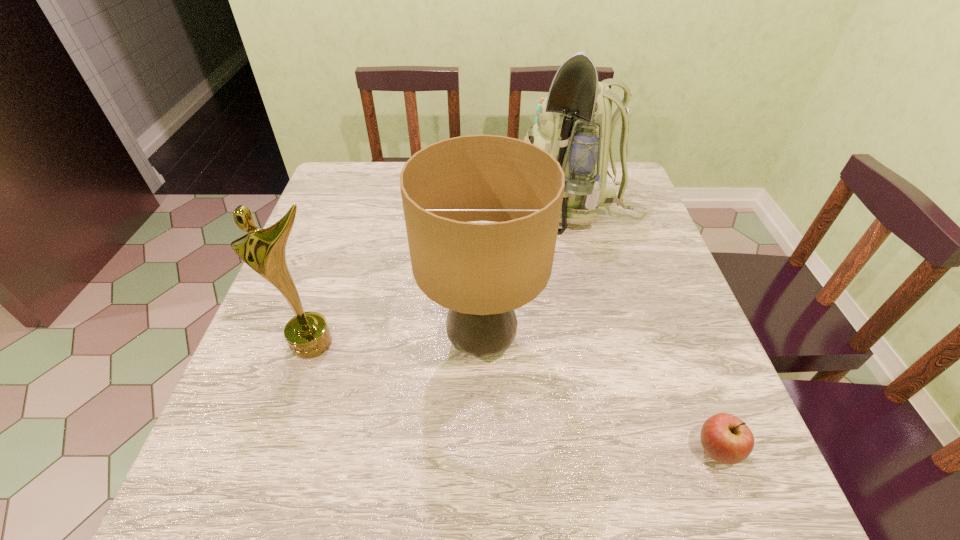
You are a GUI agent. You are given a task and a screenshot of the screen. Output one action in this format:
    pyautogui.click(x=<x>, y=<y>)
    Task: Click on the free space in the image that satisfies the following two spatial constraints: 1. on the front-facing side of the farthest object; 2. on the front-facing side of the leftmost object
    
    Given the screenshot: What is the action you would take?
    pyautogui.click(x=616, y=342)

The image size is (960, 540). I want to click on vacant area that satisfies the following two spatial constraints: 1. on the front-facing side of the farthest object; 2. on the front-facing side of the award, so click(616, 342).

Identify the location of vacant region that satisfies the following two spatial constraints: 1. on the front-facing side of the backpack; 2. on the back side of the nearest object. This screenshot has height=540, width=960. pyautogui.click(x=646, y=451).

The width and height of the screenshot is (960, 540). Identify the location of free spot that satisfies the following two spatial constraints: 1. on the front-facing side of the backpack; 2. on the front-facing side of the award. (616, 342).